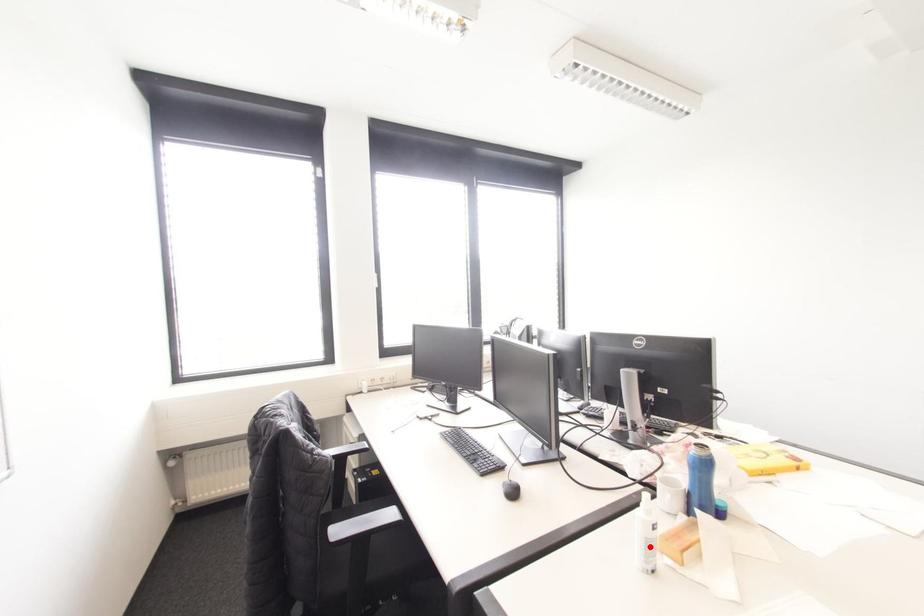
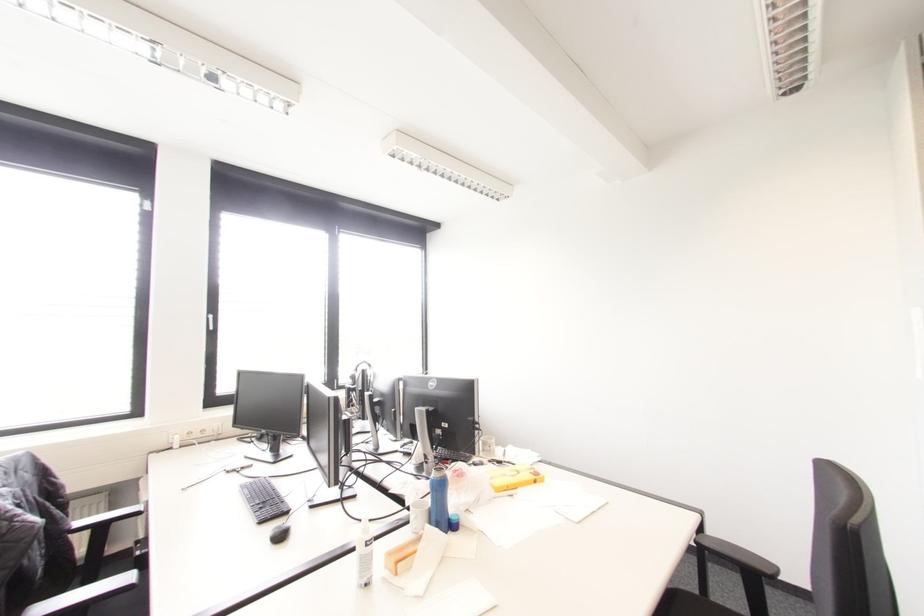
Find the pixel in the second image that matches the highlighted location in the first image.

(365, 562)